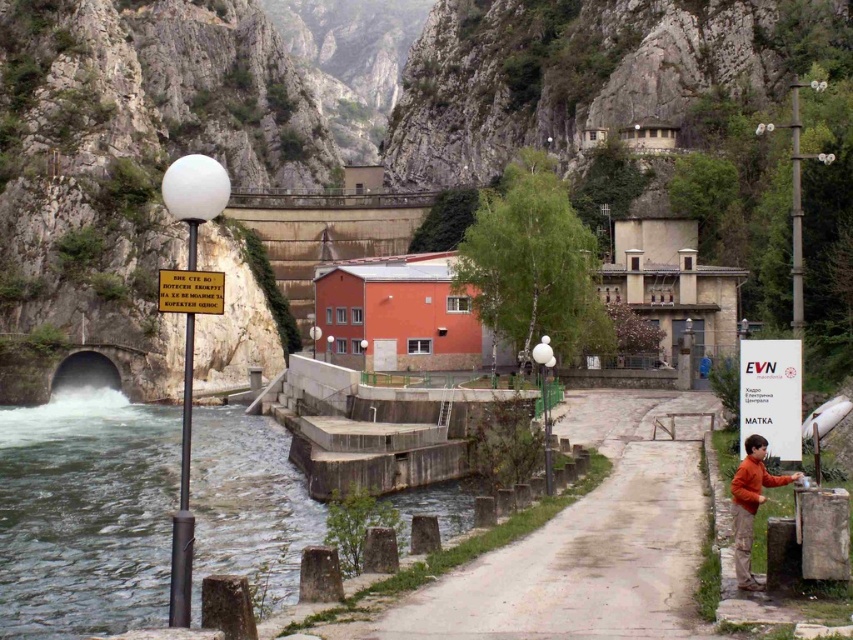
You are standing at the entrance of the hydroelectric power station and see two points marked on the ground. The first point is at coordinate point (630,451) and the second point is at coordinate point (740,502). Which point is closer to you?

Point (630,451) is closer to you because it is further to the viewer than point (740,502).

In the scene shown: You are standing at the viewpoint overlooking the hydroelectric power station. There is a specific point marked at coordinates point (x=670, y=513). You have a drone that can fly up to 40 meters. Can your drone reach that point from your current position?

The point (x=670, y=513) is 38.11 meters away from viewer, so yes, the drone can reach it since its maximum range is 40 meters.

You are standing at the origin point of the image coordinates. You want to walk to the gray concrete path at center. Which direction should you move in terms of x and y coordinates?

You should move towards the x coordinate 0.850 and y coordinate 0.692 to reach the gray concrete path at center.